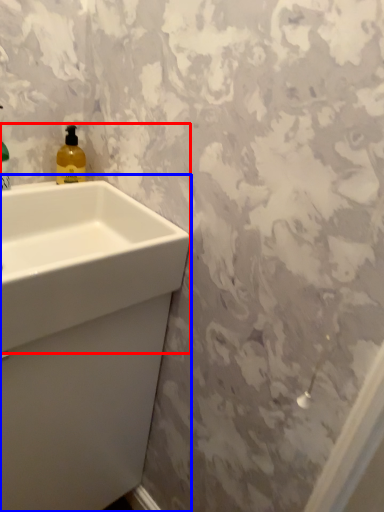
Question: Which object is closer to the camera taking this photo, sink (highlighted by a red box) or sink (highlighted by a blue box)?

Choices:
 (A) sink
 (B) sink

Answer: (A)